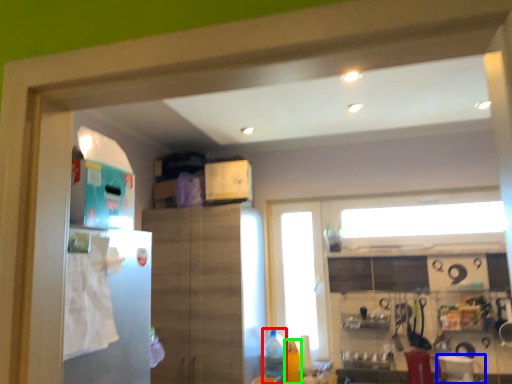
Question: Which object is the closest to the bottle (highlighted by a red box)? Choose among these: appliance (highlighted by a blue box) or bottle (highlighted by a green box).

Choices:
 (A) appliance
 (B) bottle

Answer: (B)